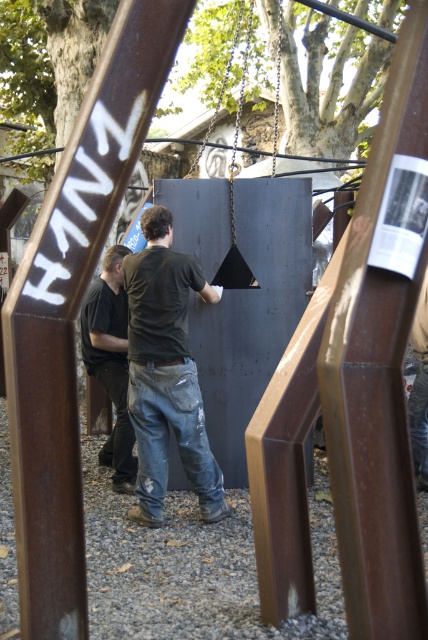
You are standing in the outdoor scene and want to locate the brushed metal sign at upper left. According to the coordinates provided, where should you look relative to the two rusted beams?

The brushed metal sign at upper left is located at coordinates point (82, 205), which is to the left side of the two rusted beams.

Based on the scene description, where is the black matte shirt at center located in the image?

The black matte shirt at center is located at the 2D coordinates point [166,372] in the image.